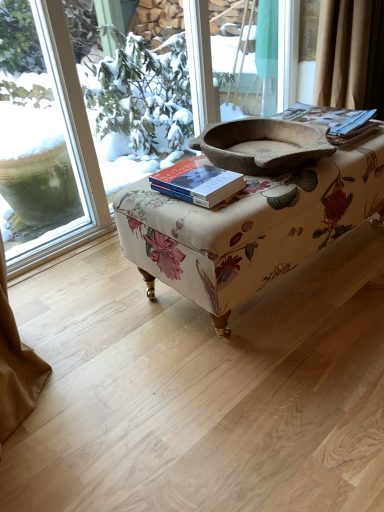
I want to click on free location above hardcover book at center, the second paperback book positioned from the right (from a real-world perspective), so click(x=200, y=176).